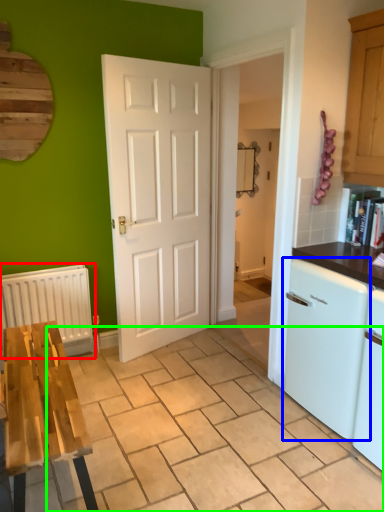
Question: Which object is positioned closest to radiator (highlighted by a red box)? Select from dish washer (highlighted by a blue box) and tile (highlighted by a green box).

Choices:
 (A) dish washer
 (B) tile

Answer: (B)